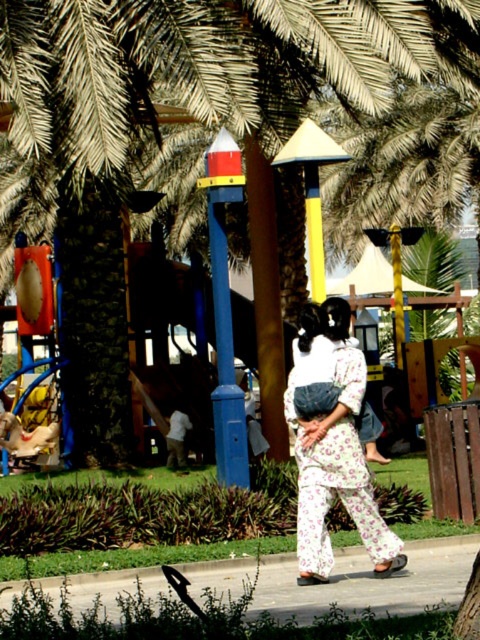
You are planning to take a photo of the green leafy palm tree at center and the floral cotton kimono at center. Which object should you focus on first if you want to capture both in the same frame without moving the camera?

The green leafy palm tree at center is larger in size than the floral cotton kimono at center, so you should focus on the palm tree first to ensure it fits properly in the frame before adjusting for the smaller kimono.

You are standing at the playground and want to reach the point marked at coordinates (305, 13). Given that the distance between you and this point is 18.18 meters, can you estimate how long it would take to walk there at a normal pace?

The distance between you and the point marked at coordinates (305, 13) is 18.18 meters. Walking at a normal pace of about 1.4 meters per second, it would take approximately 13 seconds to reach the point.